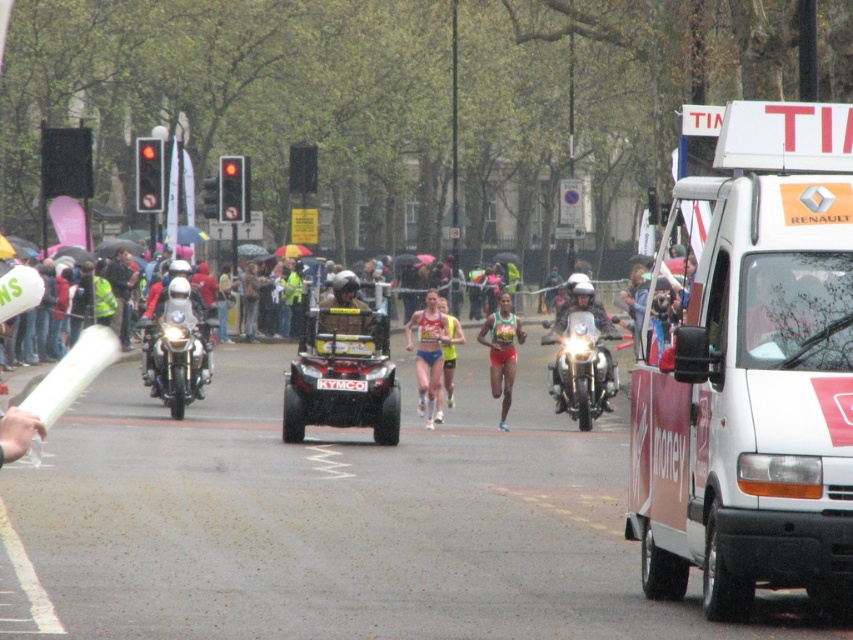
Who is more forward, (376, 316) or (415, 355)?

Point (376, 316)

Does point (335, 364) lie behind point (418, 362)?

No, it is not.

What are the coordinates of `metallic silver quad bike at center` in the screenshot? It's located at (341, 374).

Does shiny chrome motorcycle at left have a lesser width compared to matte blue shorts at center?

No, shiny chrome motorcycle at left is not thinner than matte blue shorts at center.

Who is lower down, shiny chrome motorcycle at left or matte blue shorts at center?

Positioned lower is matte blue shorts at center.

Between point (180, 314) and point (430, 305), which one is positioned behind?

Point (180, 314)

You are a GUI agent. You are given a task and a screenshot of the screen. Output one action in this format:
    pyautogui.click(x=<x>, y=<y>)
    Task: Click on the shiny chrome motorcycle at left
    The height and width of the screenshot is (640, 853).
    Given the screenshot: What is the action you would take?
    pyautogui.click(x=177, y=358)

Is point (595, 406) more distant than point (490, 324)?

Yes.

The height and width of the screenshot is (640, 853). What do you see at coordinates (582, 368) in the screenshot? I see `shiny chrome motorcycle at center` at bounding box center [582, 368].

This screenshot has width=853, height=640. Identify the location of shiny chrome motorcycle at center. (582, 368).

Image resolution: width=853 pixels, height=640 pixels. Find the location of `shiny chrome motorcycle at center`. shiny chrome motorcycle at center is located at coordinates (582, 368).